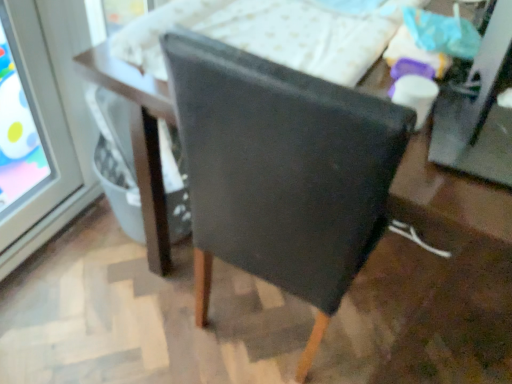
Question: Can matte black chair at center be found inside white textured mattress at upper center?

Choices:
 (A) no
 (B) yes

Answer: (A)

Question: Is white textured mattress at upper center smaller than matte black chair at center?

Choices:
 (A) no
 (B) yes

Answer: (B)

Question: From a real-world perspective, is white textured mattress at upper center on matte black chair at center?

Choices:
 (A) no
 (B) yes

Answer: (B)

Question: From the image's perspective, is white textured mattress at upper center above matte black chair at center?

Choices:
 (A) no
 (B) yes

Answer: (B)

Question: Is white textured mattress at upper center behind matte black chair at center?

Choices:
 (A) no
 (B) yes

Answer: (B)

Question: Would you say white textured mattress at upper center is inside or outside matte black chair at center?

Choices:
 (A) inside
 (B) outside

Answer: (B)

Question: Would you say white textured mattress at upper center is to the left or to the right of matte black chair at center in the picture?

Choices:
 (A) right
 (B) left

Answer: (B)

Question: From their relative heights in the image, would you say white textured mattress at upper center is taller or shorter than matte black chair at center?

Choices:
 (A) tall
 (B) short

Answer: (B)

Question: In the image, is white textured mattress at upper center positioned in front of or behind matte black chair at center?

Choices:
 (A) behind
 (B) front

Answer: (A)

Question: In terms of height, does white textured mattress at upper center look taller or shorter compared to matte black table at center?

Choices:
 (A) tall
 (B) short

Answer: (B)

Question: In the image, is white textured mattress at upper center on the left side or the right side of matte black table at center?

Choices:
 (A) right
 (B) left

Answer: (A)

Question: Is white textured mattress at upper center spatially inside matte black table at center, or outside of it?

Choices:
 (A) inside
 (B) outside

Answer: (B)

Question: Based on their sizes in the image, would you say white textured mattress at upper center is bigger or smaller than matte black table at center?

Choices:
 (A) small
 (B) big

Answer: (A)

Question: Is point (143, 104) closer or farther from the camera than point (265, 48)?

Choices:
 (A) farther
 (B) closer

Answer: (B)

Question: Is matte black table at center taller or shorter than white textured mattress at upper center?

Choices:
 (A) tall
 (B) short

Answer: (A)